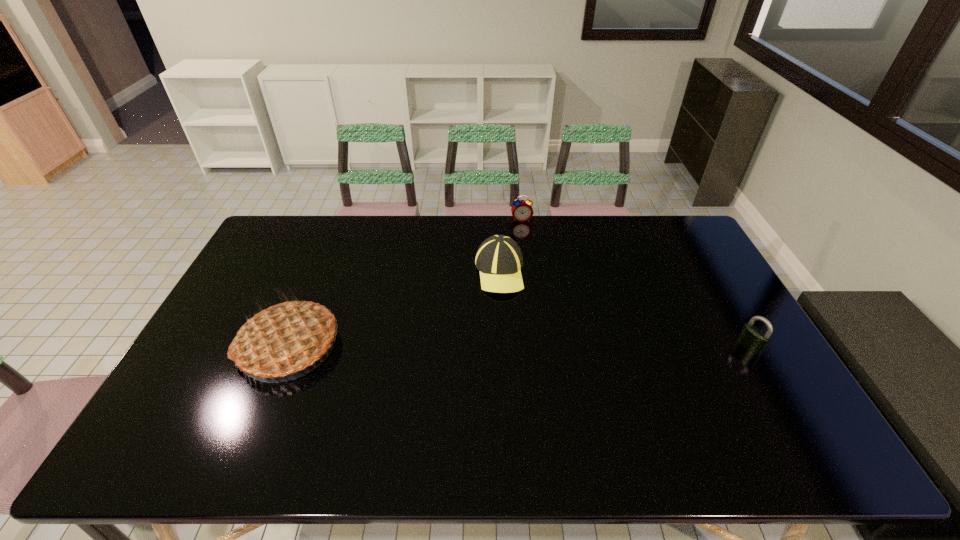
Locate an element on the screen. vacant region between the leftmost object and the alarm clock is located at coordinates (405, 282).

The height and width of the screenshot is (540, 960). I want to click on free area in between the padlock and the second farthest object, so click(x=624, y=309).

Identify the location of object that stands as the closest to the padlock. (499, 259).

Identify which object is located as the second nearest to the farthest object. Please provide its 2D coordinates. Your answer should be formatted as a tuple, i.e. [(x, y)], where the tuple contains the x and y coordinates of a point satisfying the conditions above.

[(284, 338)]

Where is `free location that satisfies the following two spatial constraints: 1. on the back side of the farthest object; 2. on the right side of the pie`? free location that satisfies the following two spatial constraints: 1. on the back side of the farthest object; 2. on the right side of the pie is located at coordinates 341,219.

Image resolution: width=960 pixels, height=540 pixels. Identify the location of vacant position in the image that satisfies the following two spatial constraints: 1. on the back side of the pie; 2. on the left side of the alarm clock. (341, 219).

Where is `free spot that satisfies the following two spatial constraints: 1. on the front side of the pie; 2. on the right side of the rightmost object`? The height and width of the screenshot is (540, 960). free spot that satisfies the following two spatial constraints: 1. on the front side of the pie; 2. on the right side of the rightmost object is located at coordinates point(290,346).